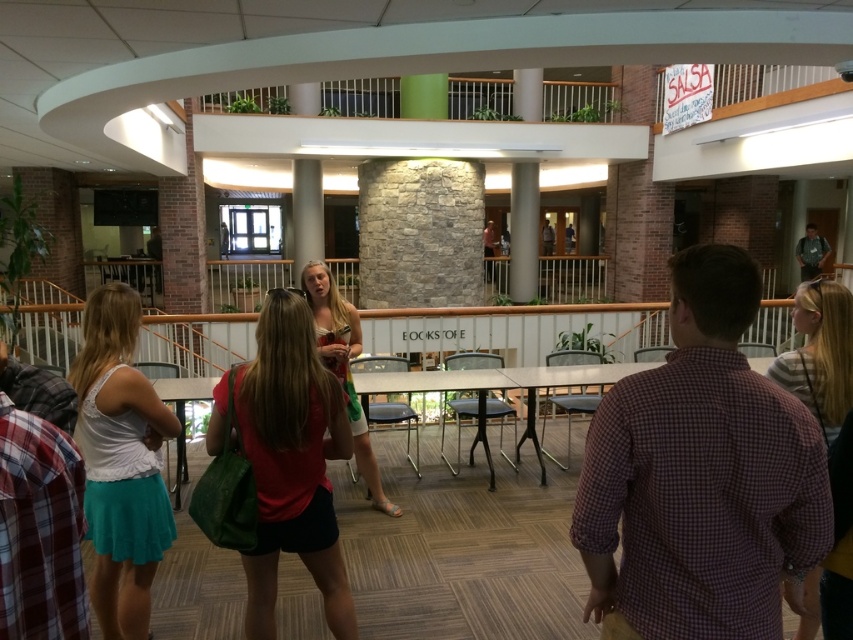
Question: From the image, what is the correct spatial relationship of matte white tank top at left in relation to matte white tank top at center?

Choices:
 (A) right
 (B) left

Answer: (B)

Question: In this image, where is matte green bag at center located relative to matte white tank top at center?

Choices:
 (A) above
 (B) below

Answer: (B)

Question: Which object appears farthest from the camera in this image?

Choices:
 (A) matte white tank top at left
 (B) matte white tank top at center
 (C) matte green bag at center

Answer: (B)

Question: Which object is positioned farthest from the plaid cotton shirt at upper right?

Choices:
 (A) matte white tank top at left
 (B) matte green bag at center
 (C) matte white tank top at center

Answer: (C)

Question: Which point is closer to the camera?

Choices:
 (A) plaid cotton shirt at upper right
 (B) matte white tank top at left

Answer: (A)

Question: Is plaid cotton shirt at upper right smaller than matte green bag at center?

Choices:
 (A) yes
 (B) no

Answer: (B)